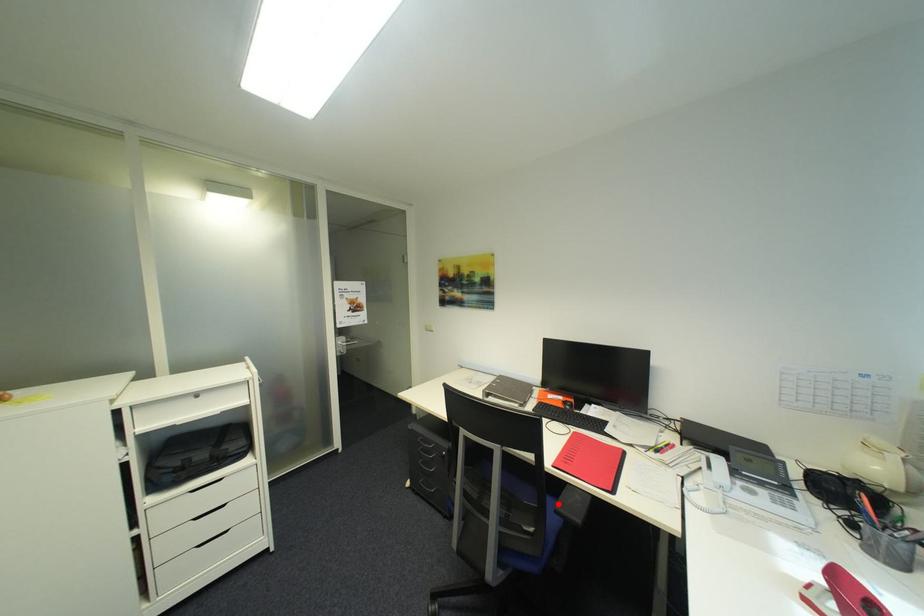
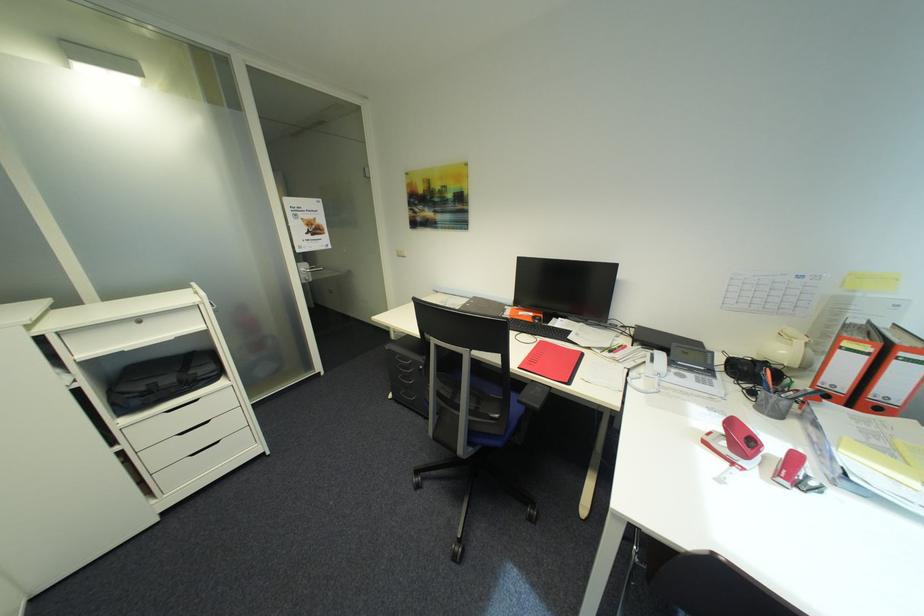
Find the pixel in the second image that matches the highlighted location in the first image.

(523, 395)